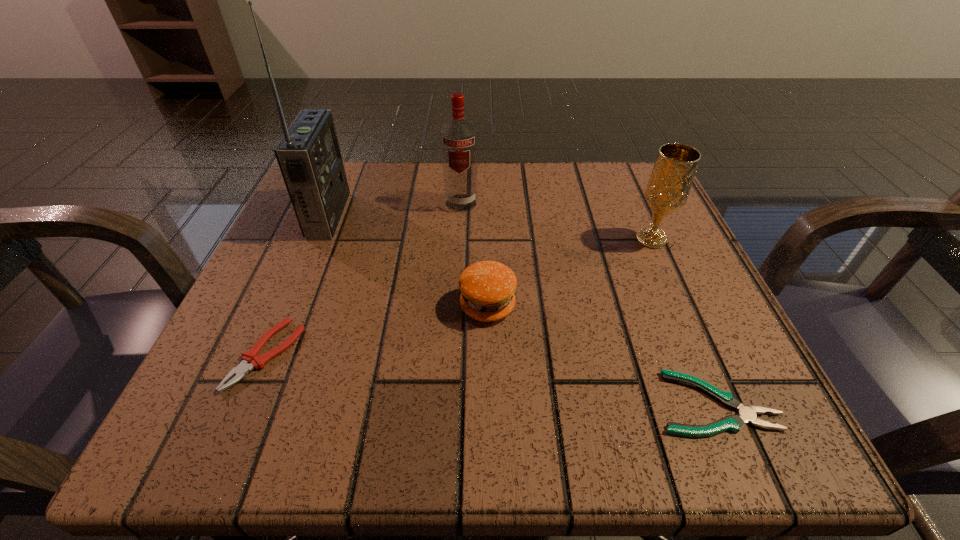
The height and width of the screenshot is (540, 960). I want to click on free point between the left pliers and the shortest object, so click(x=491, y=379).

The image size is (960, 540). I want to click on free area in between the third tallest object and the tallest object, so click(490, 227).

The height and width of the screenshot is (540, 960). Identify the location of vacant space that's between the shortest object and the tallest object. (522, 309).

This screenshot has height=540, width=960. Identify the location of empty location between the fourth shortest object and the patty. (569, 273).

This screenshot has width=960, height=540. I want to click on vacant point located between the patty and the fifth shortest object, so click(x=474, y=254).

Identify the location of free space between the fourth shortest object and the vodka. (556, 221).

The width and height of the screenshot is (960, 540). Identify the location of empty space that is in between the patty and the tallest object. (408, 261).

This screenshot has height=540, width=960. In order to click on empty space between the shorter pliers and the tallest object in this screenshot , I will do `click(522, 309)`.

The width and height of the screenshot is (960, 540). What are the coordinates of `free spot between the shorter pliers and the third shortest object` in the screenshot? It's located at (601, 355).

Locate which object ranks second in proximity to the fourth tallest object. Please provide its 2D coordinates. Your answer should be formatted as a tuple, i.e. [(x, y)], where the tuple contains the x and y coordinates of a point satisfying the conditions above.

[(459, 138)]